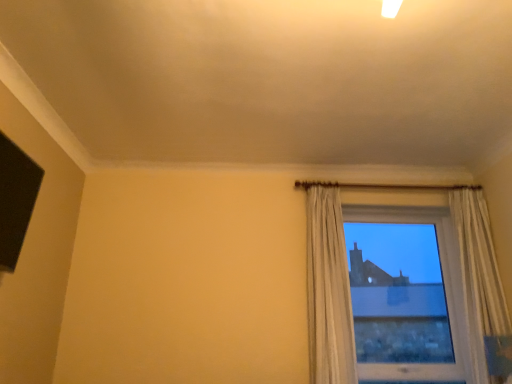
Locate an element on the screen. Image resolution: width=512 pixels, height=384 pixels. transparent glass window at right is located at coordinates (398, 294).

What do you see at coordinates (398, 294) in the screenshot?
I see `transparent glass window at right` at bounding box center [398, 294].

This screenshot has height=384, width=512. What do you see at coordinates (328, 288) in the screenshot?
I see `white sheer curtain at right` at bounding box center [328, 288].

What is the approximate height of white sheer curtain at right?

4.65 feet.

Find the location of a particular element. The height and width of the screenshot is (384, 512). white sheer curtain at right is located at coordinates (328, 288).

The width and height of the screenshot is (512, 384). Identify the location of transparent glass window at right. point(398,294).

In the image, is white sheer curtain at right on the left side or the right side of transparent glass window at right?

In the image, white sheer curtain at right appears on the left side of transparent glass window at right.

Is white sheer curtain at right positioned before transparent glass window at right?

That is True.

Between point (341, 225) and point (444, 311), which one is positioned in front?

The point (341, 225) is closer to the camera.

From the image's perspective, which object appears higher, white sheer curtain at right or transparent glass window at right?

From the image's view, white sheer curtain at right is above.

From a real-world perspective, which object rests below the other?

transparent glass window at right.

Is white sheer curtain at right wider or thinner than transparent glass window at right?

white sheer curtain at right is wider than transparent glass window at right.

Can you confirm if white sheer curtain at right is taller than transparent glass window at right?

Yes.

Can you confirm if white sheer curtain at right is smaller than transparent glass window at right?

Correct, white sheer curtain at right occupies less space than transparent glass window at right.

Is white sheer curtain at right inside or outside of transparent glass window at right?

white sheer curtain at right is outside transparent glass window at right.

Is white sheer curtain at right next to transparent glass window at right and touching it?

No, white sheer curtain at right is not in contact with transparent glass window at right.

Is white sheer curtain at right aimed at transparent glass window at right?

No, white sheer curtain at right is not turned towards transparent glass window at right.

Can you tell me how much white sheer curtain at right and transparent glass window at right differ in facing direction?

0.0106 degrees separate the facing orientations of white sheer curtain at right and transparent glass window at right.

Where is `curtain in front of the transparent glass window at right`? The width and height of the screenshot is (512, 384). curtain in front of the transparent glass window at right is located at coordinates [328, 288].

Between transparent glass window at right and white sheer curtain at right, which one appears on the right side from the viewer's perspective?

From the viewer's perspective, transparent glass window at right appears more on the right side.

Which object is closer to the camera, transparent glass window at right or white sheer curtain at right?

white sheer curtain at right is closer to the camera.

Does point (372, 332) come farther from viewer compared to point (312, 308)?

Yes, point (372, 332) is behind point (312, 308).

From the image's perspective, between transparent glass window at right and white sheer curtain at right, who is located below?

transparent glass window at right, from the image's perspective.

From a real-world perspective, is transparent glass window at right on white sheer curtain at right?

Incorrect, from a real-world perspective, transparent glass window at right is lower than white sheer curtain at right.

Which of these two, transparent glass window at right or white sheer curtain at right, is wider?

Wider between the two is white sheer curtain at right.

Which of these two, transparent glass window at right or white sheer curtain at right, stands taller?

With more height is white sheer curtain at right.

Is transparent glass window at right smaller than white sheer curtain at right?

Actually, transparent glass window at right might be larger than white sheer curtain at right.

Would you say transparent glass window at right contains white sheer curtain at right?

That's incorrect, white sheer curtain at right is not inside transparent glass window at right.

Is transparent glass window at right in contact with white sheer curtain at right?

No, transparent glass window at right is not next to white sheer curtain at right.

Is white sheer curtain at right at the back of transparent glass window at right?

No, transparent glass window at right's orientation is not away from white sheer curtain at right.

How many degrees apart are the facing directions of transparent glass window at right and white sheer curtain at right?

0.0106 degrees separate the facing orientations of transparent glass window at right and white sheer curtain at right.

Image resolution: width=512 pixels, height=384 pixels. I want to click on curtain in front of the transparent glass window at right, so click(328, 288).

Identify the location of window screen below the white sheer curtain at right (from the image's perspective). (398, 294).

Where is `window screen on the right of the white sheer curtain at right`? window screen on the right of the white sheer curtain at right is located at coordinates (398, 294).